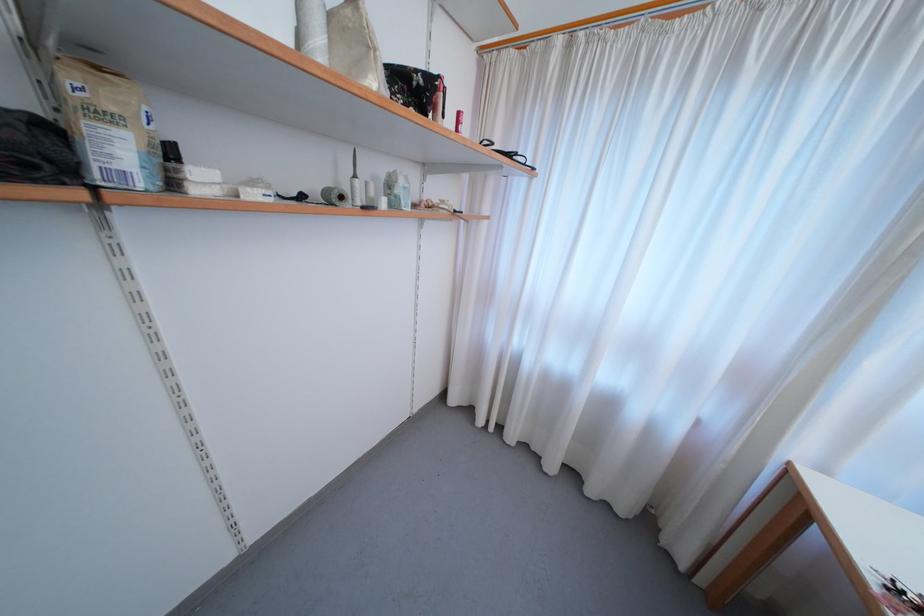
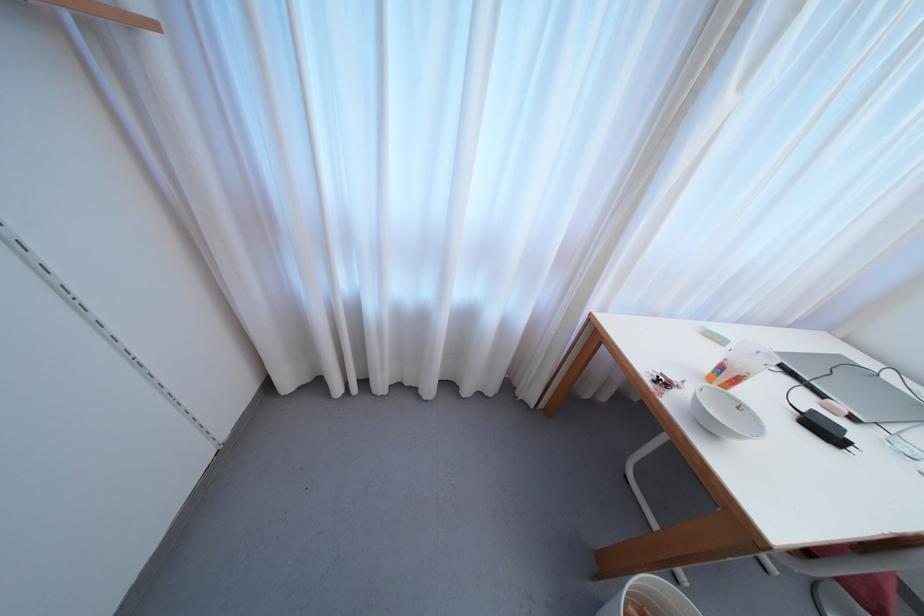
First-person continuous shooting, in which direction is the camera rotating?

The camera rotated toward right-down.